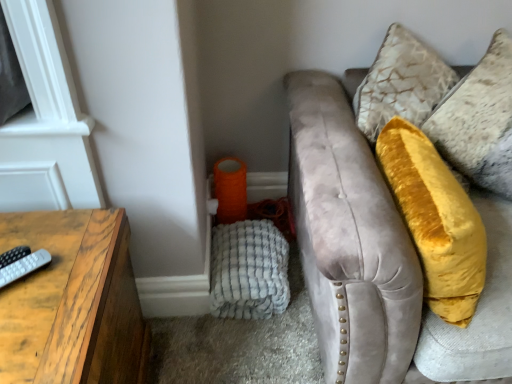
Where is `unoccupied area behind gray matte remote at left`? unoccupied area behind gray matte remote at left is located at coordinates (53, 232).